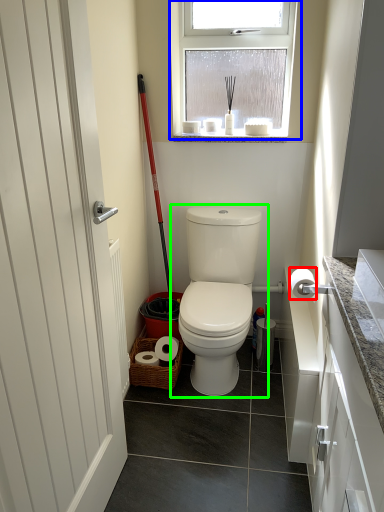
Question: Considering the real-world distances, which object is farthest from toilet paper (highlighted by a red box)? window (highlighted by a blue box) or toilet (highlighted by a green box)?

Choices:
 (A) window
 (B) toilet

Answer: (A)